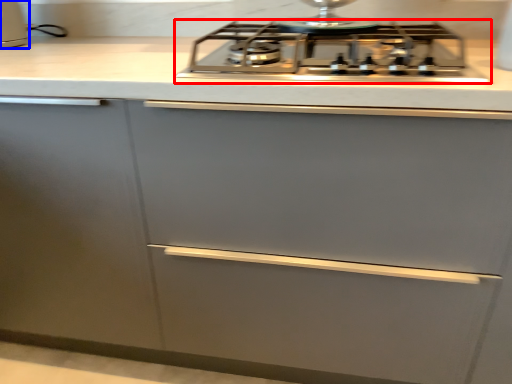
Question: Which of the following is the closest to the observer, gas stove (highlighted by a red box) or kitchen appliance (highlighted by a blue box)?

Choices:
 (A) gas stove
 (B) kitchen appliance

Answer: (A)